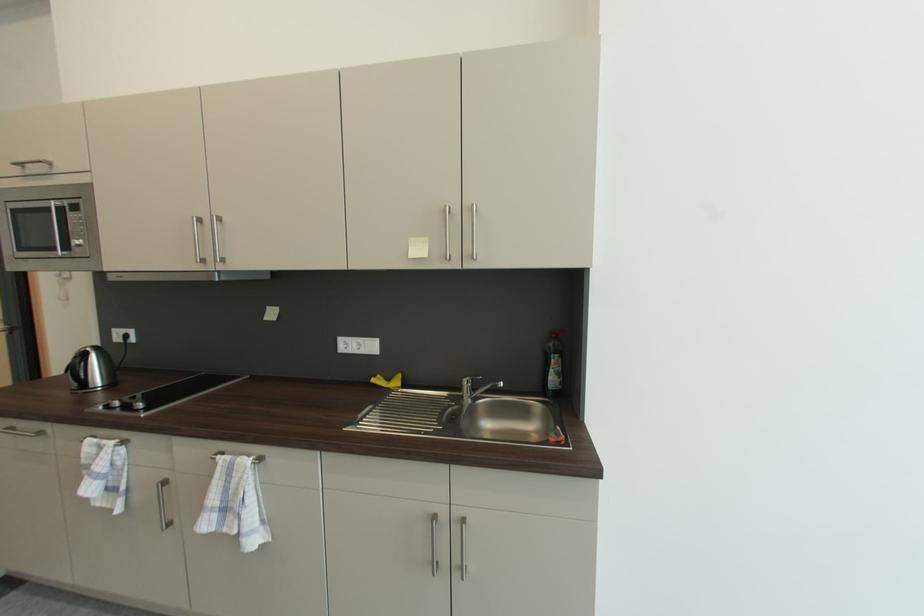
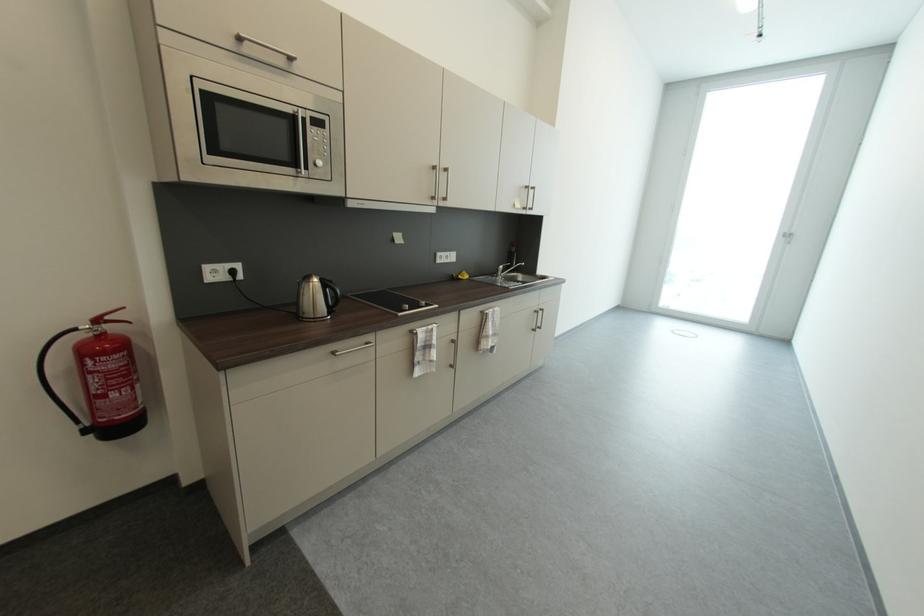
Find the pixel in the second image that matches the point at 417,257 in the first image.

(523, 209)